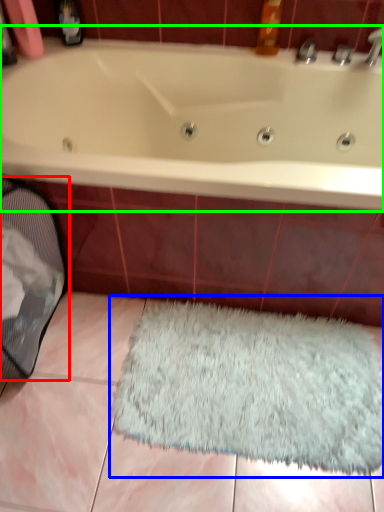
Question: Which is nearer to the laundry basket (highlighted by a red box)? doormat (highlighted by a blue box) or bathtub (highlighted by a green box).

Choices:
 (A) doormat
 (B) bathtub

Answer: (B)